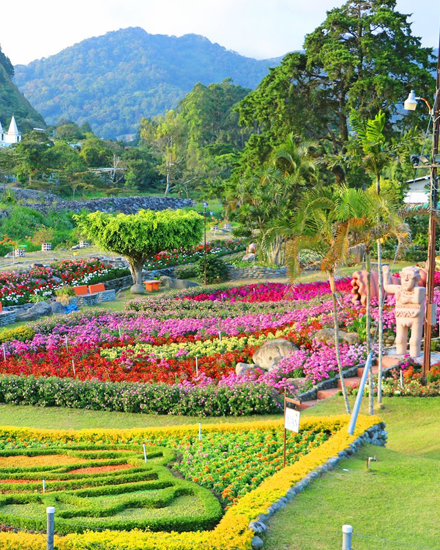
The width and height of the screenshot is (440, 550). Identify the location of orange flowers. (405, 374).